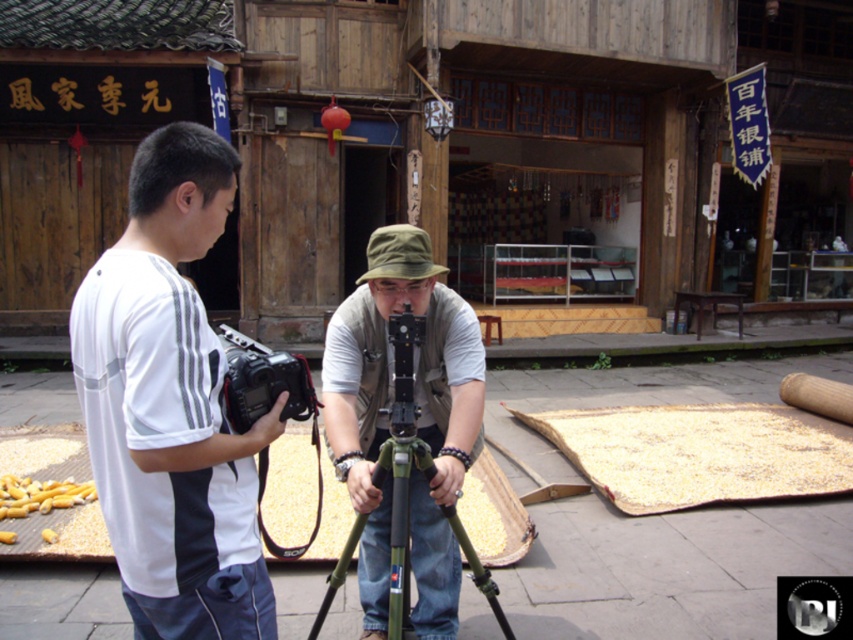
Is point (378, 484) more distant than point (251, 353)?

Yes, it is behind point (251, 353).

Can you confirm if green matte tripod at center is positioned below black plastic camera at center?

Indeed, green matte tripod at center is positioned under black plastic camera at center.

Is point (390, 538) closer to viewer compared to point (273, 381)?

That is False.

You are a GUI agent. You are given a task and a screenshot of the screen. Output one action in this format:
    pyautogui.click(x=<x>, y=<y>)
    Task: Click on the green matte tripod at center
    
    Given the screenshot: What is the action you would take?
    pyautogui.click(x=399, y=513)

Based on the photo, is white fabric camera at left taller than khaki fabric hat at center?

No, white fabric camera at left is not taller than khaki fabric hat at center.

Is white fabric camera at left further to camera compared to khaki fabric hat at center?

No, white fabric camera at left is in front of khaki fabric hat at center.

Which is behind, point (137, 429) or point (381, 376)?

The point (381, 376) is behind.

Locate an element on the screen. white fabric camera at left is located at coordinates (171, 404).

Is white fabric camera at left further to camera compared to black plastic camera at center?

No, it is in front of black plastic camera at center.

Which of these two, white fabric camera at left or black plastic camera at center, stands taller?

With more height is white fabric camera at left.

Image resolution: width=853 pixels, height=640 pixels. Find the location of `white fabric camera at left`. white fabric camera at left is located at coordinates (171, 404).

The width and height of the screenshot is (853, 640). What are the coordinates of `white fabric camera at left` in the screenshot? It's located at 171,404.